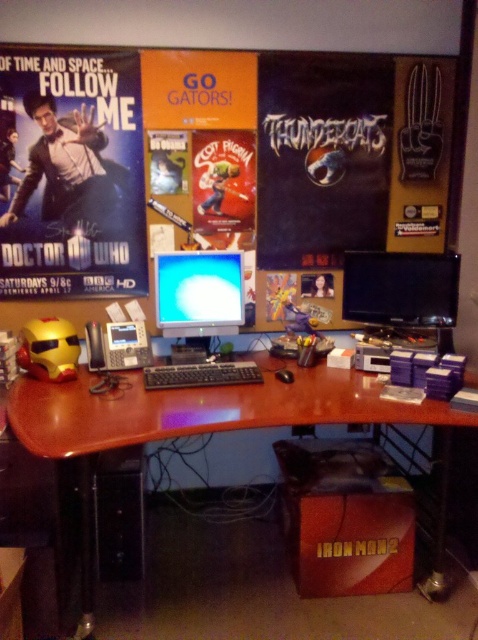
Question: Among these objects, which one is nearest to the camera?

Choices:
 (A) brown glossy computer desk at center
 (B) wooden bulletin board at upper center
 (C) matte paper poster at upper left

Answer: (A)

Question: Which object appears farthest from the camera in this image?

Choices:
 (A) black matte keyboard at center
 (B) wooden bulletin board at upper center

Answer: (B)

Question: Is black glossy monitor at right wider than black matte keyboard at center?

Choices:
 (A) yes
 (B) no

Answer: (B)

Question: From the image, what is the correct spatial relationship of brown glossy computer desk at center in relation to matte plastic monitor at center?

Choices:
 (A) below
 (B) above

Answer: (A)

Question: Does black glossy monitor at right have a larger size compared to matte plastic monitor at center?

Choices:
 (A) yes
 (B) no

Answer: (A)

Question: Among these objects, which one is farthest from the camera?

Choices:
 (A) matte plastic monitor at center
 (B) matte paper poster at upper left
 (C) black matte keyboard at center
 (D) brown glossy computer desk at center

Answer: (A)